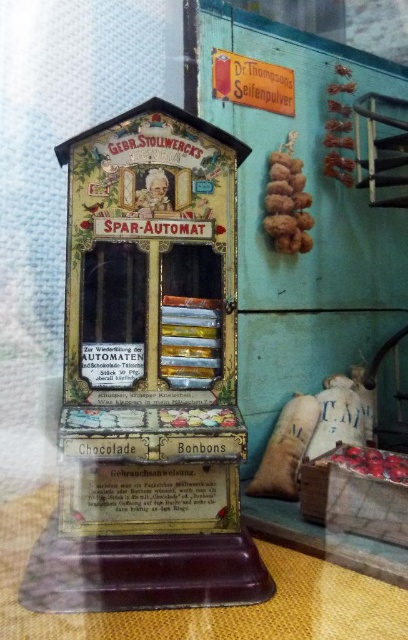
Which of these two, shiny metallic automat at center or matte yellow sign at upper center, stands taller?

shiny metallic automat at center

This screenshot has height=640, width=408. What are the coordinates of `shiny metallic automat at center` in the screenshot? It's located at (148, 376).

Measure the distance between shiny metallic automat at center and camera.

shiny metallic automat at center and camera are 32.50 inches apart.

Identify the location of shiny metallic automat at center. (148, 376).